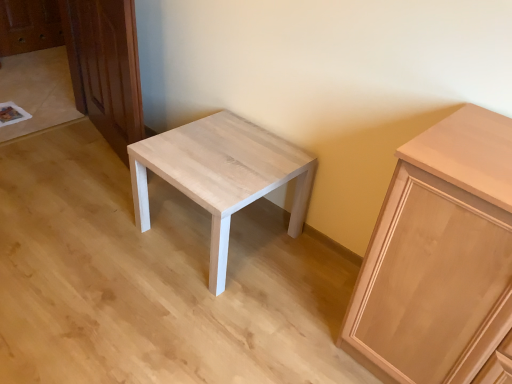
Find the location of `vacant area that lies in front of light brown wood dresser at left`. vacant area that lies in front of light brown wood dresser at left is located at coordinates (69, 222).